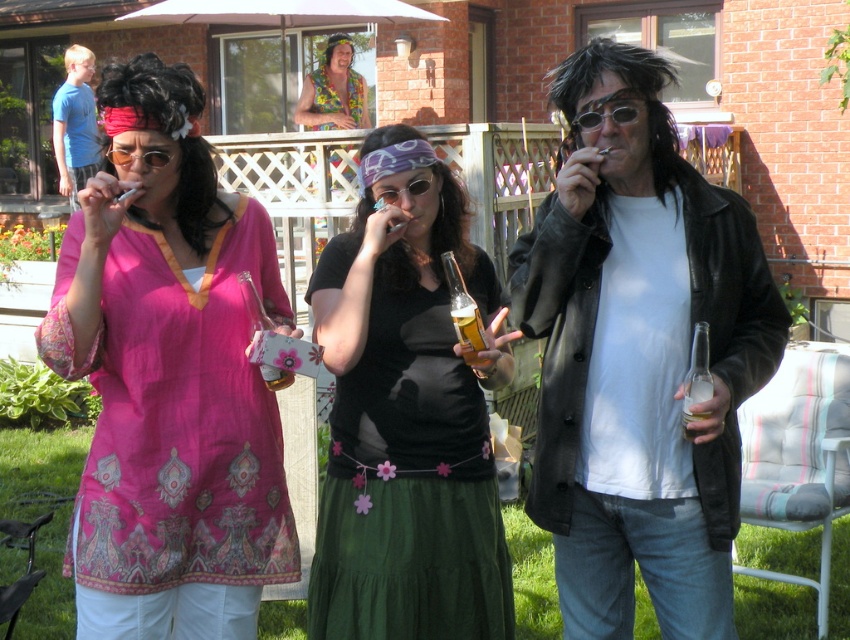
Does pink fabric shirt at center have a greater width compared to shiny black sunglasses at center?

Indeed, pink fabric shirt at center has a greater width compared to shiny black sunglasses at center.

Is point (230, 452) closer to viewer compared to point (595, 109)?

No, it is behind (595, 109).

Does point (95, 374) lie in front of point (604, 115)?

No, it is not.

You are a GUI agent. You are given a task and a screenshot of the screen. Output one action in this format:
    pyautogui.click(x=<x>, y=<y>)
    Task: Click on the pink fabric shirt at center
    This screenshot has height=640, width=850.
    Given the screenshot: What is the action you would take?
    pyautogui.click(x=170, y=378)

Who is shorter, matte black jacket at center or pink fabric shirt at center?

pink fabric shirt at center

Is matte black jacket at center taller than pink fabric shirt at center?

Yes.

Which is in front, point (647, 385) or point (64, 337)?

Point (64, 337) is more forward.

Locate an element on the screen. This screenshot has width=850, height=640. matte black jacket at center is located at coordinates (639, 358).

Is point (667, 444) less distant than point (344, 81)?

Yes, it is.

Image resolution: width=850 pixels, height=640 pixels. I want to click on matte black jacket at center, so click(x=639, y=358).